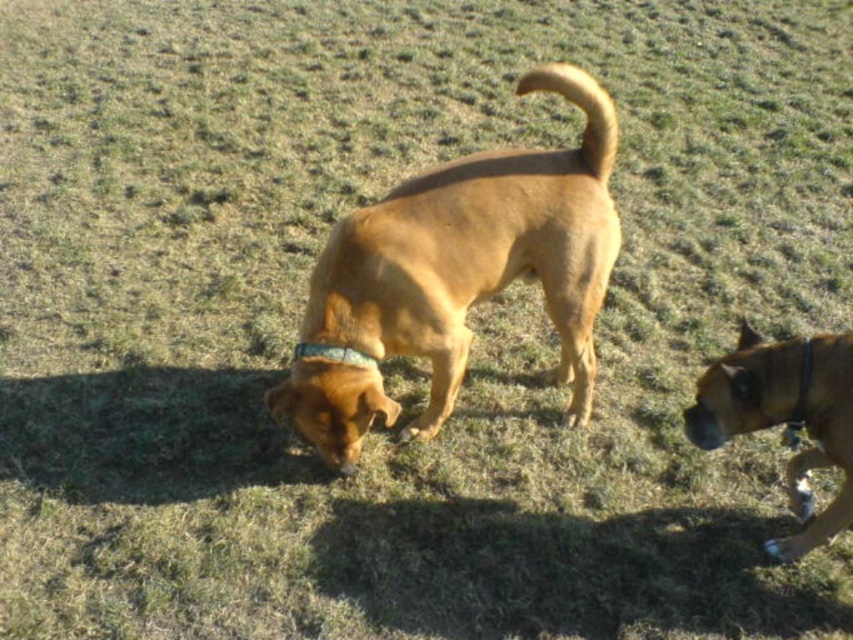
Who is more forward, (496, 262) or (724, 424)?

Point (724, 424) is more forward.

Based on the photo, is brown matte dog at center positioned at the back of brown leather dog at center?

Yes, brown matte dog at center is behind brown leather dog at center.

Which is behind, point (311, 298) or point (830, 426)?

The point (311, 298) is behind.

Locate an element on the screen. Image resolution: width=853 pixels, height=640 pixels. brown matte dog at center is located at coordinates (456, 275).